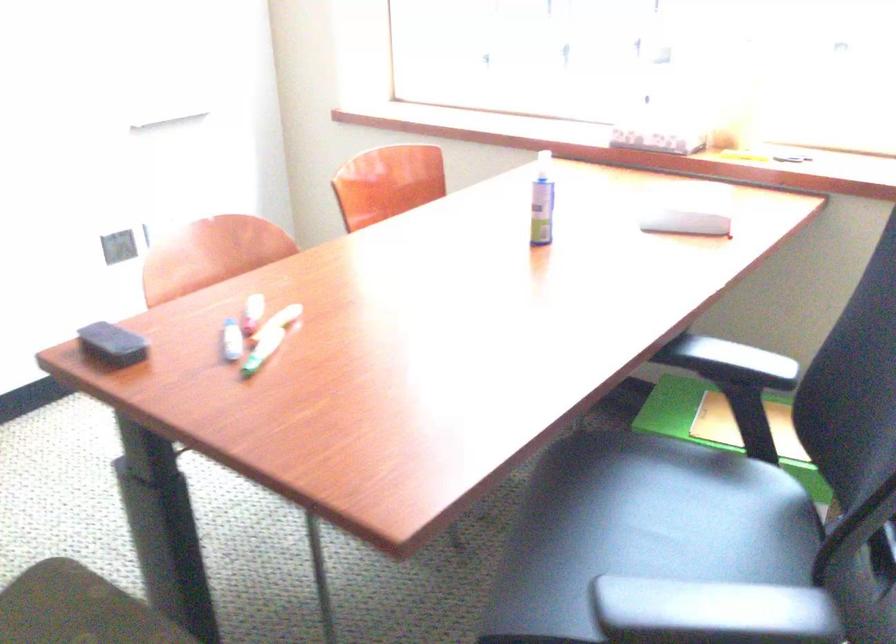
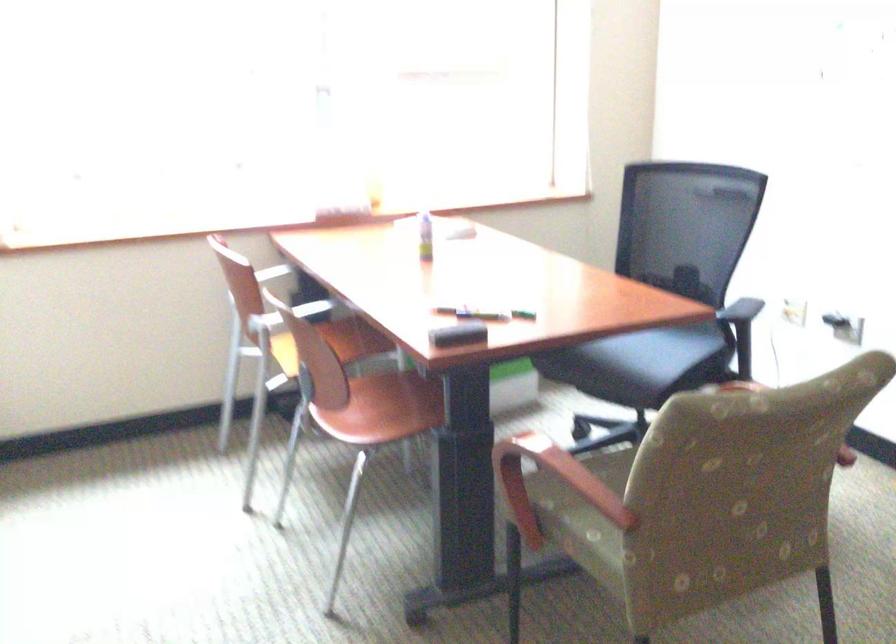
Find the pixel in the second image that matches point (618, 554) in the first image.

(649, 348)